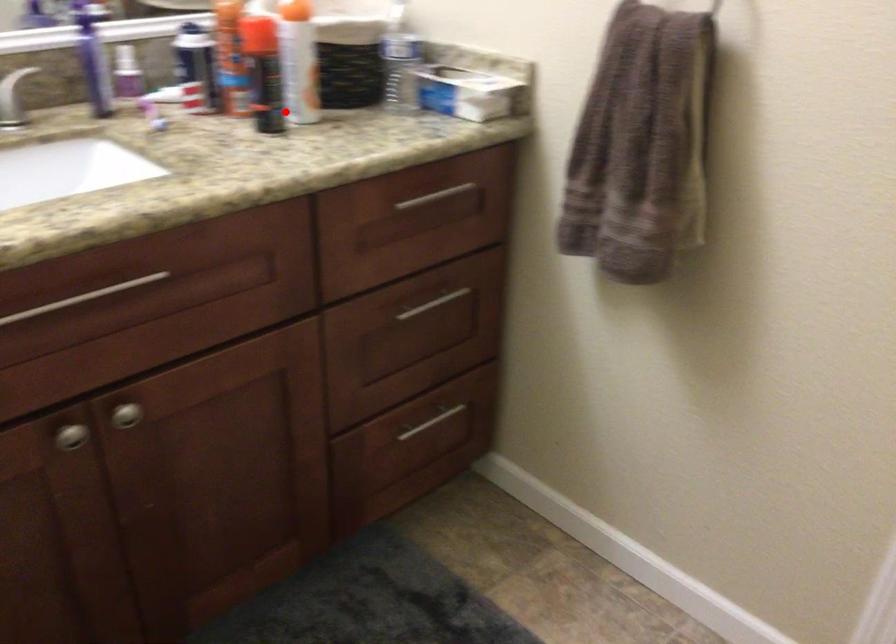
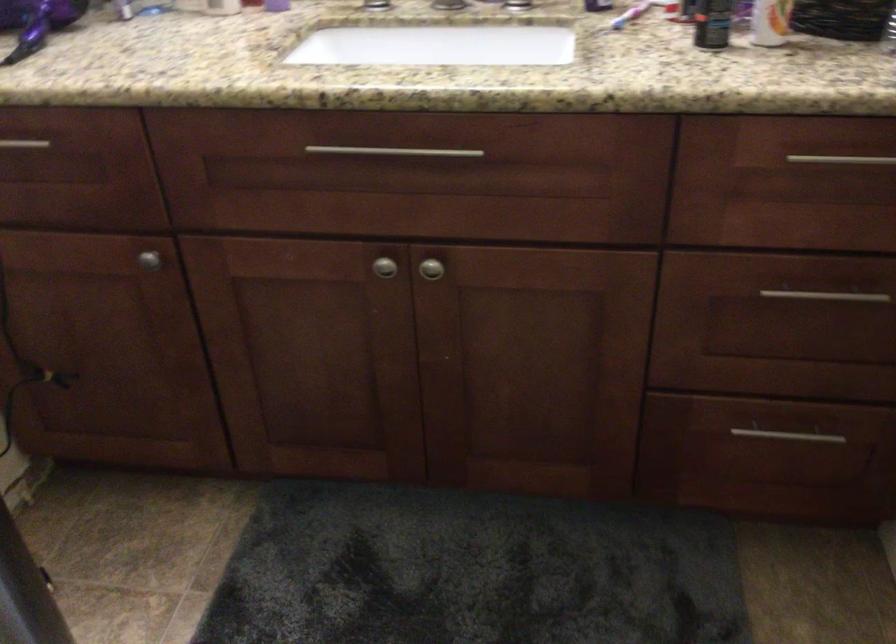
Question: I am providing you with two images of the same scene from different viewpoints. In image1, a red point is highlighted. Considering the same 3D point in image2, which of the following is correct?

Choices:
 (A) It is closer
 (B) It is farther

Answer: (A)